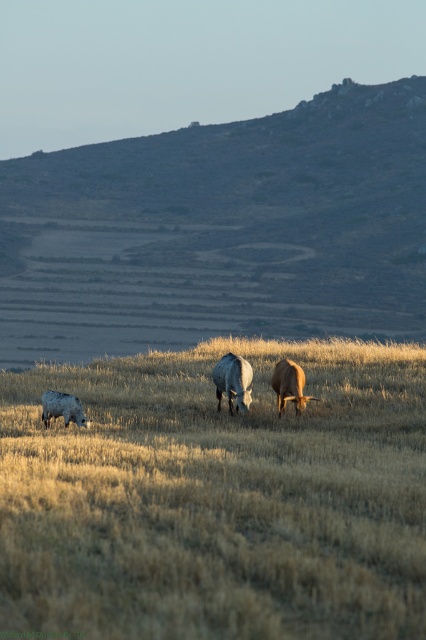
You are a farmer checking your land. You see the dull gray stone hillside at upper center and the white woolly sheep at lower left. Which object takes up more space in the image?

The dull gray stone hillside at upper center is larger in size than the white woolly sheep at lower left, so it takes up more space in the image.

You are a farmer checking the field. You notice the dry grass at center and the brown matte cow at center. Which one takes up more space in the image?

The dry grass at center takes up more space in the image because it is larger in size than the brown matte cow at center.